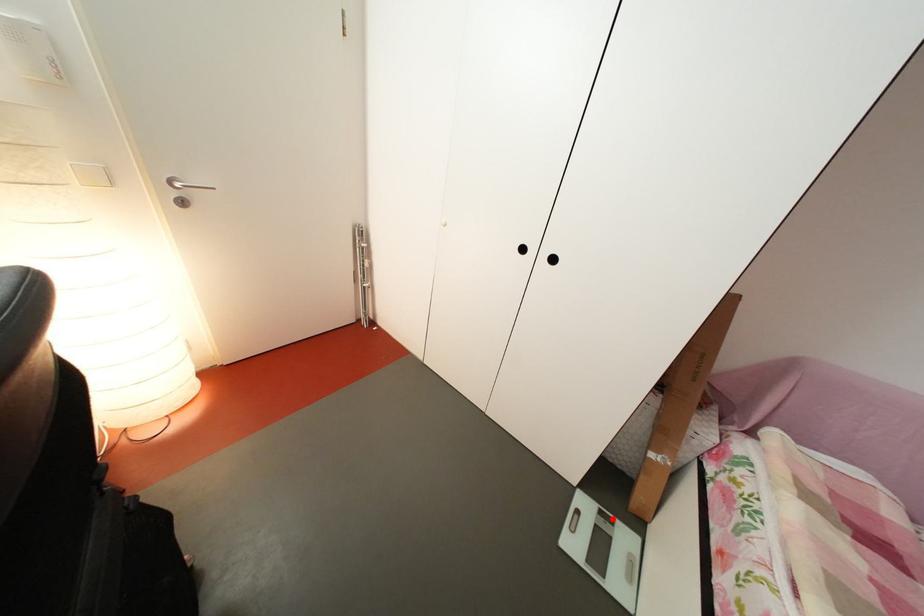
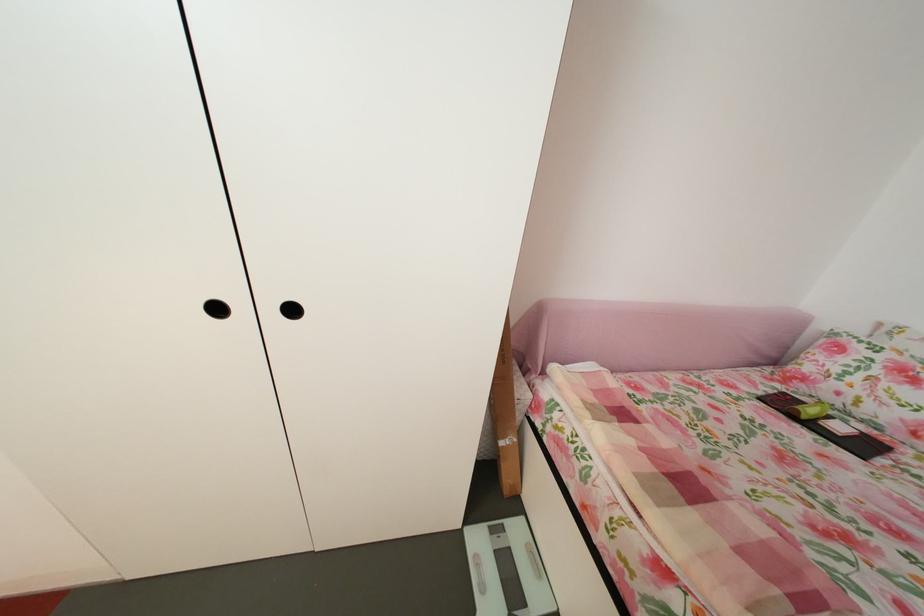
In the second image, find the point that corresponds to the highlighted location in the first image.

(504, 537)